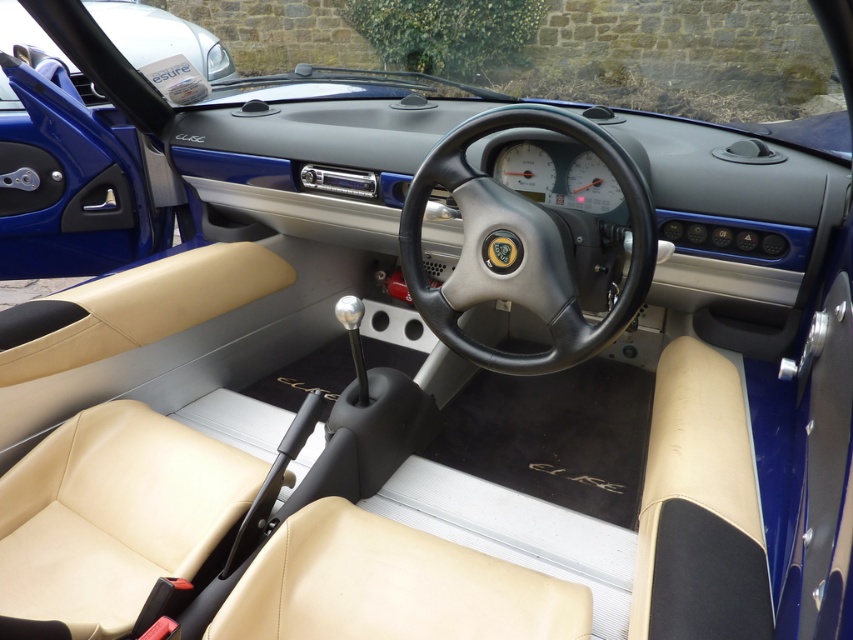
Between matte black steering wheel at center and white plastic gauge at center, which one has less height?

white plastic gauge at center

Does matte black steering wheel at center appear on the right side of white plastic gauge at center?

Incorrect, matte black steering wheel at center is not on the right side of white plastic gauge at center.

Which is in front, point (165, 22) or point (502, 180)?

Point (502, 180) is more forward.

This screenshot has width=853, height=640. Identify the location of matte black steering wheel at center. (160, 36).

Is black leather steering wheel at center thinner than white plastic gauge at center?

No.

Which is behind, point (531, 106) or point (511, 168)?

The point (511, 168) is more distant.

Who is more forward, [556,124] or [538,195]?

Point [556,124] is in front.

The image size is (853, 640). In order to click on black leather steering wheel at center in this screenshot , I will do [x=520, y=244].

Which is more to the right, black leather steering wheel at center or matte black steering wheel at center?

black leather steering wheel at center is more to the right.

Can you confirm if black leather steering wheel at center is wider than matte black steering wheel at center?

Incorrect, black leather steering wheel at center's width does not surpass matte black steering wheel at center's.

In order to click on black leather steering wheel at center in this screenshot , I will do `click(520, 244)`.